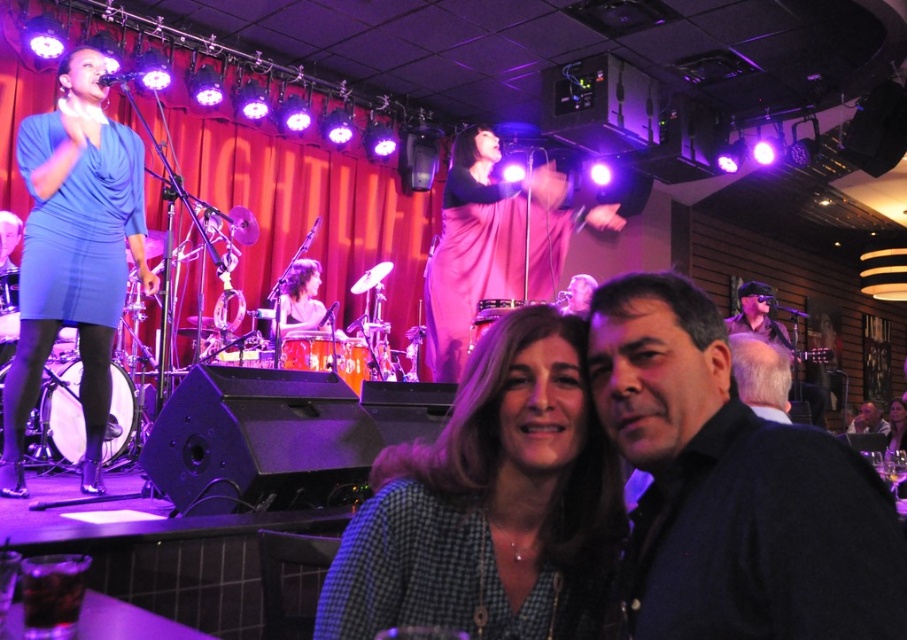
Question: Is pink satin dress at center to the right of metallic silver microphone at upper left from the viewer's perspective?

Choices:
 (A) no
 (B) yes

Answer: (B)

Question: Does gray hair at right have a lesser width compared to matte pink dress at center?

Choices:
 (A) no
 (B) yes

Answer: (B)

Question: Is pink satin dress at center positioned behind gray hair at right?

Choices:
 (A) yes
 (B) no

Answer: (A)

Question: Estimate the real-world distances between objects in this image. Which object is farther from the checkered fabric shirt at center?

Choices:
 (A) dark blue sweater at center
 (B) metallic silver microphone at upper left
 (C) gray hair at right
 (D) matte blue dress at left

Answer: (B)

Question: Estimate the real-world distances between objects in this image. Which object is closer to the matte blue dress at left?

Choices:
 (A) checkered fabric shirt at center
 (B) gray hair at right

Answer: (B)

Question: Estimate the real-world distances between objects in this image. Which object is closer to the pink satin dress at center?

Choices:
 (A) metallic silver microphone at upper left
 (B) checkered fabric shirt at center
 (C) gray hair at right

Answer: (C)